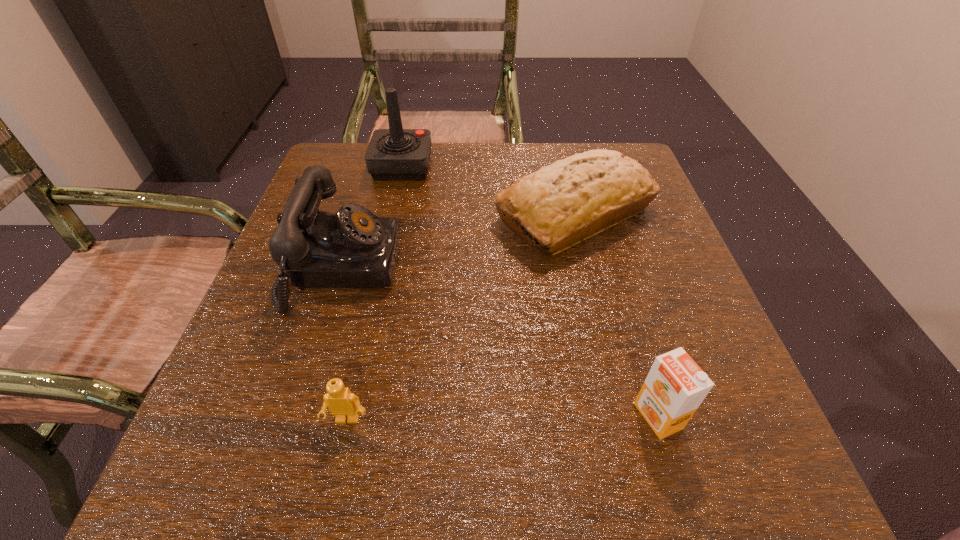
Where is `bread that is at the far edge`? Image resolution: width=960 pixels, height=540 pixels. bread that is at the far edge is located at coordinates (580, 196).

Find the location of a particular element. This screenshot has width=960, height=540. object located at the near edge is located at coordinates (675, 386).

Identify the location of joystick located in the left edge section of the desktop. Image resolution: width=960 pixels, height=540 pixels. (393, 154).

What are the coordinates of `telephone that is positioned at the left edge` in the screenshot? It's located at (353, 248).

I want to click on bread at the right edge, so click(x=580, y=196).

Where is `orange juice at the right edge`? The width and height of the screenshot is (960, 540). orange juice at the right edge is located at coordinates (675, 386).

What are the coordinates of `object positioned at the far left corner` in the screenshot? It's located at (393, 154).

The width and height of the screenshot is (960, 540). Find the location of `object that is at the far right corner`. object that is at the far right corner is located at coordinates (580, 196).

Identify the location of object present at the near right corner. (675, 386).

In the image, there is a desktop. At what (x,y) coordinates should I click in order to perform the action: click on vacant space at the far edge. Please return your answer as a coordinate pair (x, y). The height and width of the screenshot is (540, 960). Looking at the image, I should click on (485, 154).